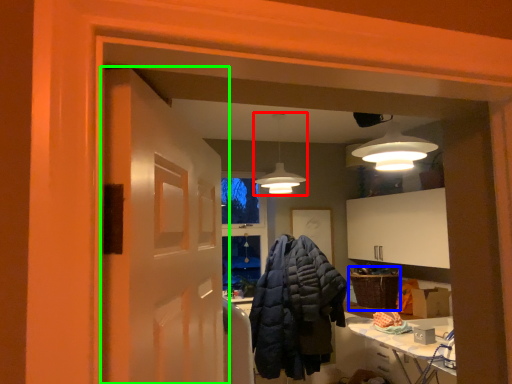
Question: Based on their relative distances, which object is farther from lighting (highlighted by a red box)? Choose from basket (highlighted by a blue box) and door (highlighted by a green box).

Choices:
 (A) basket
 (B) door

Answer: (B)